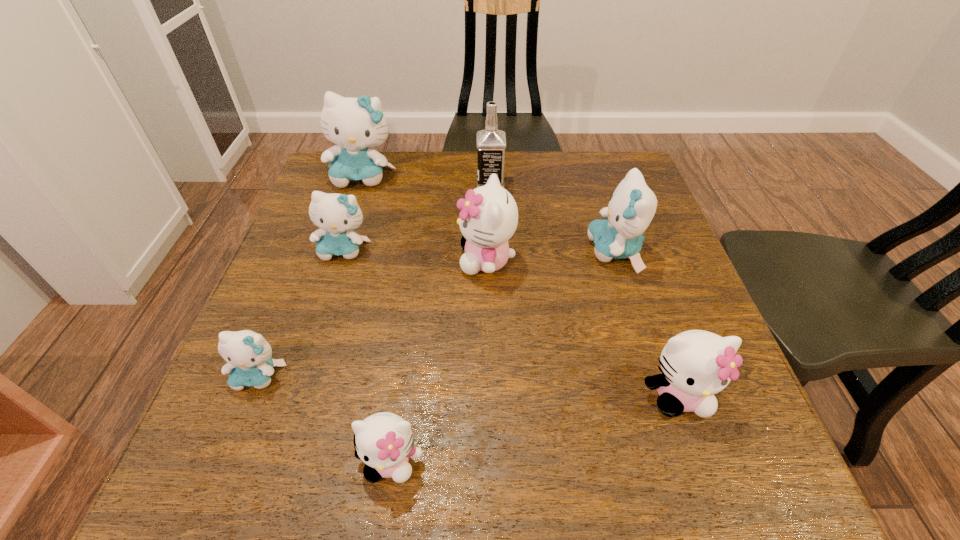
The height and width of the screenshot is (540, 960). Identify the location of the tallest kitten. (355, 124).

Locate an element on the screen. The width and height of the screenshot is (960, 540). the farthest kitten is located at coordinates (355, 124).

Locate an element on the screen. vodka is located at coordinates (491, 143).

The image size is (960, 540). Find the location of `the second biggest blue kitten`. the second biggest blue kitten is located at coordinates (632, 206).

The height and width of the screenshot is (540, 960). In order to click on the biggest white kitten in this screenshot , I will do `click(489, 215)`.

Find the location of a particular element. This screenshot has width=960, height=540. the second white kitten from right to left is located at coordinates (489, 215).

Locate an element on the screen. The height and width of the screenshot is (540, 960). the third biggest blue kitten is located at coordinates (336, 215).

Identify the location of the second smallest white kitten. The height and width of the screenshot is (540, 960). click(696, 364).

Identify the location of the second farthest white kitten. This screenshot has height=540, width=960. (696, 364).

Image resolution: width=960 pixels, height=540 pixels. Identify the location of the nearest kitten. (384, 441).